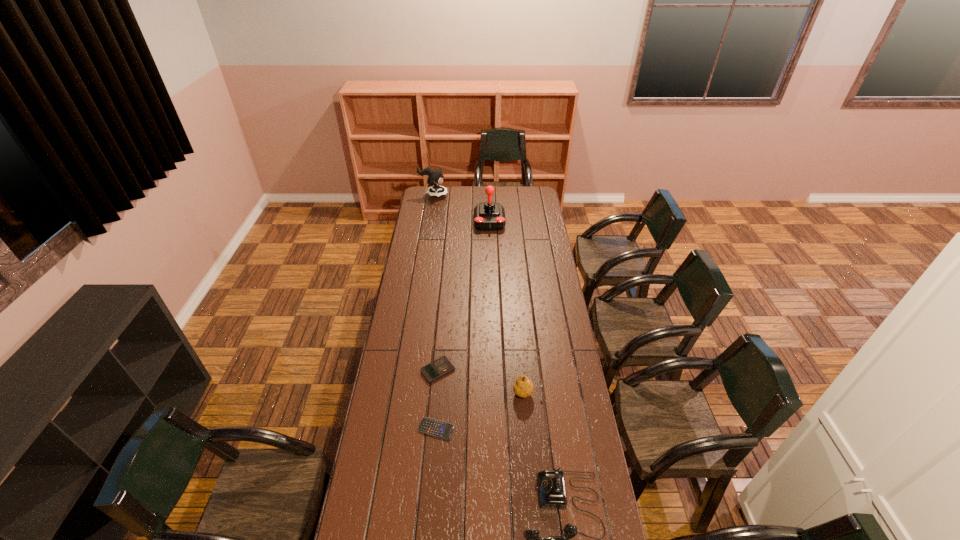
At what (x,y) coordinates should I click in order to perform the action: click on object identified as the fifth closest to the farthest object. Please return your answer as a coordinate pair (x, y). The image size is (960, 540). Looking at the image, I should click on (551, 483).

Find the location of `free space in the image that satisfies the following two spatial constraints: 1. at the face of the doll; 2. on the left side of the pear`. free space in the image that satisfies the following two spatial constraints: 1. at the face of the doll; 2. on the left side of the pear is located at coordinates (403, 393).

In order to click on free location that satisfies the following two spatial constraints: 1. at the face of the doll; 2. on the left side of the fourth farthest object in this screenshot , I will do `click(403, 393)`.

Image resolution: width=960 pixels, height=540 pixels. I want to click on free spot that satisfies the following two spatial constraints: 1. at the face of the doll; 2. on the left side of the nearer calculator, so click(x=397, y=429).

Locate an element on the screen. Image resolution: width=960 pixels, height=540 pixels. free space that satisfies the following two spatial constraints: 1. at the face of the fourth farthest object; 2. on the left side of the doll is located at coordinates (403, 393).